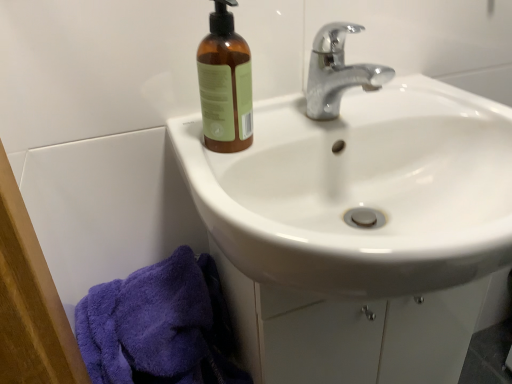
Question: From a real-world perspective, is white glossy sink at upper center positioned under brown glass bottle at upper left based on gravity?

Choices:
 (A) no
 (B) yes

Answer: (B)

Question: Is white glossy sink at upper center directly adjacent to brown glass bottle at upper left?

Choices:
 (A) no
 (B) yes

Answer: (A)

Question: Can you confirm if white glossy sink at upper center is wider than brown glass bottle at upper left?

Choices:
 (A) yes
 (B) no

Answer: (A)

Question: Is white glossy sink at upper center positioned behind brown glass bottle at upper left?

Choices:
 (A) yes
 (B) no

Answer: (B)

Question: From a real-world perspective, is white glossy sink at upper center physically above brown glass bottle at upper left?

Choices:
 (A) no
 (B) yes

Answer: (A)

Question: Considering the relative positions of brown glass bottle at upper left and chrome metallic faucet at upper center in the image provided, is brown glass bottle at upper left to the left or to the right of chrome metallic faucet at upper center?

Choices:
 (A) right
 (B) left

Answer: (B)

Question: From a real-world perspective, is brown glass bottle at upper left above or below chrome metallic faucet at upper center?

Choices:
 (A) above
 (B) below

Answer: (A)

Question: Considering the positions of brown glass bottle at upper left and chrome metallic faucet at upper center in the image, is brown glass bottle at upper left taller or shorter than chrome metallic faucet at upper center?

Choices:
 (A) tall
 (B) short

Answer: (A)

Question: Does point (205, 82) appear closer or farther from the camera than point (339, 26)?

Choices:
 (A) closer
 (B) farther

Answer: (A)

Question: Visually, is chrome metallic faucet at upper center positioned to the left or to the right of white glossy sink at upper center?

Choices:
 (A) right
 (B) left

Answer: (B)

Question: Considering the positions of chrome metallic faucet at upper center and white glossy sink at upper center in the image, is chrome metallic faucet at upper center bigger or smaller than white glossy sink at upper center?

Choices:
 (A) small
 (B) big

Answer: (A)

Question: Considering the positions of chrome metallic faucet at upper center and white glossy sink at upper center in the image, is chrome metallic faucet at upper center wider or thinner than white glossy sink at upper center?

Choices:
 (A) thin
 (B) wide

Answer: (A)

Question: Choose the correct answer: Is chrome metallic faucet at upper center inside white glossy sink at upper center or outside it?

Choices:
 (A) outside
 (B) inside

Answer: (A)

Question: Is white glossy sink at upper center to the left or to the right of brown glass bottle at upper left in the image?

Choices:
 (A) left
 (B) right

Answer: (B)

Question: From a real-world perspective, relative to brown glass bottle at upper left, is white glossy sink at upper center vertically above or below?

Choices:
 (A) below
 (B) above

Answer: (A)